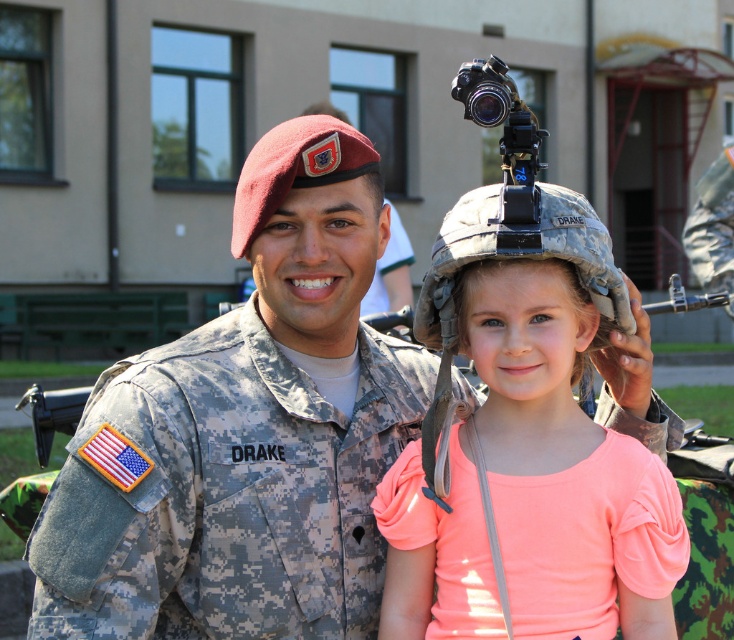
You are a photographer trying to capture a photo of the camouflage uniform at center and the camouflage helmet at center. Since you want both objects to be clearly visible in the frame, which object should you focus on first to ensure proper alignment?

→ The camouflage uniform at center is positioned on the left side of camouflage helmet at center, so you should focus on the camouflage helmet at center first to ensure proper alignment.

You are a photographer at the event and need to capture a clear shot of the camouflage fabric uniform at center without the black matte video camera at upper center blocking the view. Is this possible given their positions?

The camouflage fabric uniform at center is positioned under the black matte video camera at upper center, so it is possible to angle the camera downward to capture the uniform without obstruction from the camera.

You are a photographer setting up for a group photo. You have two items to place on a table in the scene described. The items are the camouflage uniform at center and the camouflage helmet at center. Based on their sizes, which item should you place first to ensure both fit on the table?

The camouflage uniform at center is wider than the camouflage helmet at center, so you should place the camouflage uniform at center first to ensure both items fit on the table.